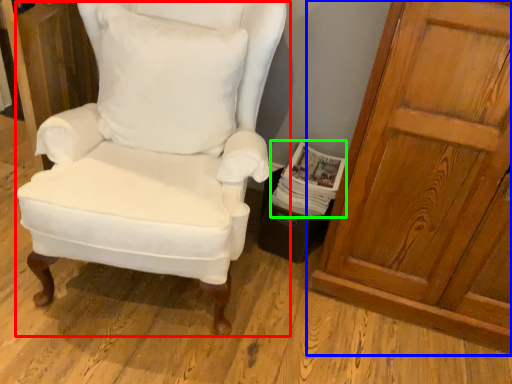
Question: Based on their relative distances, which object is farther from chair (highlighted by a red box)? Choose from door (highlighted by a blue box) and magazine (highlighted by a green box).

Choices:
 (A) door
 (B) magazine

Answer: (A)